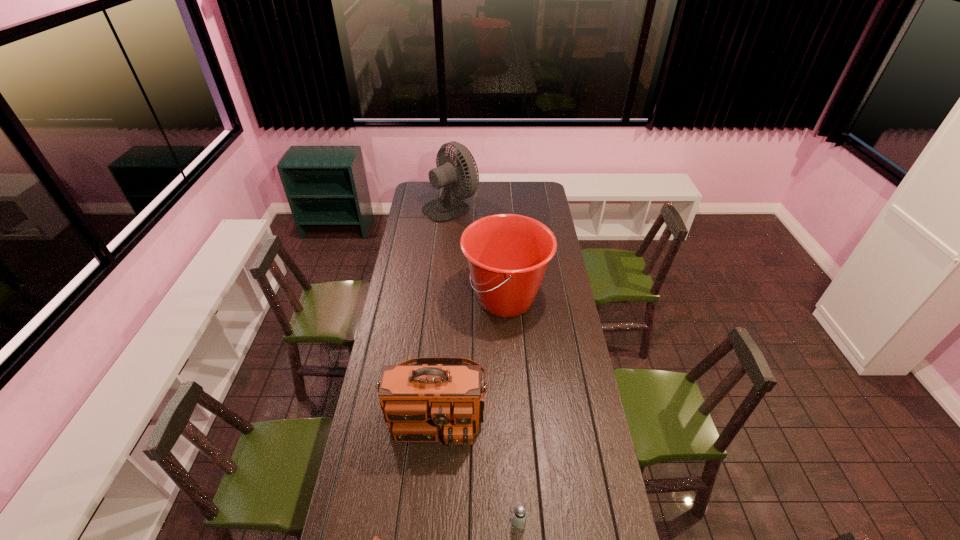
I want to click on vacant area located on the left of the fourth tallest object, so click(x=480, y=521).

Locate an element on the screen. object that is positioned at the far edge is located at coordinates (446, 208).

Where is `fan that is at the left edge`? This screenshot has height=540, width=960. fan that is at the left edge is located at coordinates (446, 208).

Locate an element on the screen. satchel present at the left edge is located at coordinates (419, 402).

Locate an element on the screen. object that is at the right edge is located at coordinates (507, 254).

The height and width of the screenshot is (540, 960). What are the coordinates of `object at the far left corner` in the screenshot? It's located at (446, 208).

In the image, there is a desktop. Find the location of `vacant space at the left edge`. vacant space at the left edge is located at coordinates (424, 227).

I want to click on free space at the right edge, so click(x=576, y=476).

Locate an element on the screen. unoccupied position between the satchel and the bucket is located at coordinates (471, 350).

Identify the location of free point between the fan and the third farthest object. This screenshot has height=540, width=960. (444, 304).